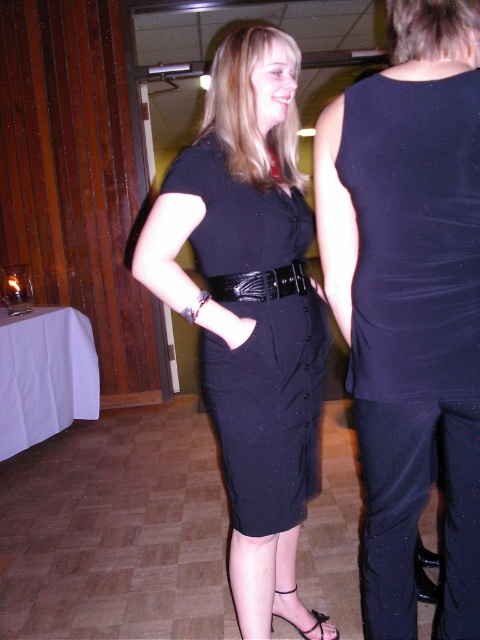
You are standing at the position of the woman in the scene. You notice two points marked in the image. The first point is at coordinate point[411,403] and the second is at point[321,616]. Which point is closer to you?

Point[411,403] is in front of point[321,616], so it is closer to you.

You are a fashion designer who wants to create a matching accessory for the outfit. The dress is 25.30 inches away from the sandal. How much space is there between the black matte dress at center and the black leather sandal at lower center?

The black matte dress at center is 25.30 inches from the black leather sandal at lower center.